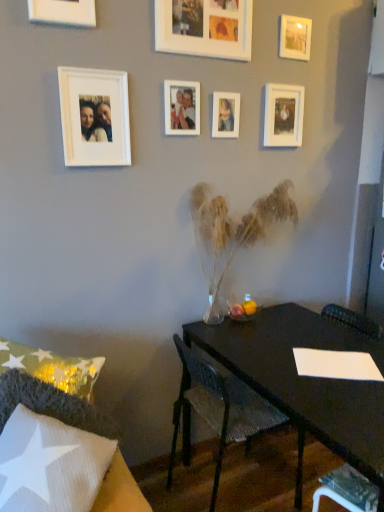
Where is `dark wood chair at lower center, which ranks as the 2th chair in left-to-right order`? The image size is (384, 512). dark wood chair at lower center, which ranks as the 2th chair in left-to-right order is located at coordinates (218, 406).

What is the approximate width of metallic silver swivel chair at lower right?

22.46 centimeters.

What do you see at coordinates (204, 28) in the screenshot?
I see `white matte picture frame at upper center, acting as the fourth picture frame starting from the right` at bounding box center [204, 28].

Image resolution: width=384 pixels, height=512 pixels. I want to click on white matte picture frame at upper left, the sixth picture frame from the right, so coord(94,117).

Where is `matte white photo frame at center, the 5th picture frame when ordered from left to right`? The height and width of the screenshot is (512, 384). matte white photo frame at center, the 5th picture frame when ordered from left to right is located at coordinates (226, 115).

Describe the element at coordinates (295, 37) in the screenshot. I see `matte white picture frame at upper right, which is counted as the first picture frame, starting from the right` at that location.

Locate an element on the screen. dark wood chair at lower center, which ranks as the 2th chair in left-to-right order is located at coordinates (218, 406).

Is white matte photo frame at center, the 3th picture frame when ordered from left to right, inside the boundaries of white matte picture frame at upper center, acting as the fourth picture frame starting from the right, or outside?

white matte photo frame at center, the 3th picture frame when ordered from left to right, is not enclosed by white matte picture frame at upper center, acting as the fourth picture frame starting from the right.

The width and height of the screenshot is (384, 512). I want to click on picture frame that is the 3rd object located above the white matte photo frame at center, the 3th picture frame when ordered from left to right (from the image's perspective), so click(204, 28).

Is white matte photo frame at center, acting as the fifth picture frame starting from the right, touching white matte picture frame at upper center, acting as the fourth picture frame starting from the right?

No, white matte photo frame at center, acting as the fifth picture frame starting from the right, is not beside white matte picture frame at upper center, acting as the fourth picture frame starting from the right.

From a real-world perspective, is white matte photo frame at center, the 3th picture frame when ordered from left to right, located beneath white matte picture frame at upper center, acting as the fourth picture frame starting from the right?

Indeed, from a real-world perspective, white matte photo frame at center, the 3th picture frame when ordered from left to right, is positioned beneath white matte picture frame at upper center, acting as the fourth picture frame starting from the right.

Choose the correct answer: Is white matte photo frame at center, acting as the fifth picture frame starting from the right, inside white matte picture frame at upper left, the 7th picture frame in the right-to-left sequence, or outside it?

white matte photo frame at center, acting as the fifth picture frame starting from the right, is outside white matte picture frame at upper left, the 7th picture frame in the right-to-left sequence.

From a real-world perspective, which object rests below the other?

white matte photo frame at center, the 3th picture frame when ordered from left to right.

Where is `the 2nd picture frame counting from the left side of the white matte photo frame at center, the 3th picture frame when ordered from left to right`? This screenshot has width=384, height=512. the 2nd picture frame counting from the left side of the white matte photo frame at center, the 3th picture frame when ordered from left to right is located at coordinates (63, 12).

What's the angular difference between white matte photo frame at center, the 3th picture frame when ordered from left to right, and white matte picture frame at upper left, the 1th picture frame viewed from the left,'s facing directions?

1.75 degrees separate the facing orientations of white matte photo frame at center, the 3th picture frame when ordered from left to right, and white matte picture frame at upper left, the 1th picture frame viewed from the left.

Could you measure the distance between white paper at lower right and dark wood chair at lower center, the 1th chair when ordered from back to front?

white paper at lower right and dark wood chair at lower center, the 1th chair when ordered from back to front, are 28.68 inches apart from each other.

Which of these two, white paper at lower right or dark wood chair at lower center, which ranks as the 2th chair in left-to-right order, is smaller?

white paper at lower right is smaller.

How many degrees apart are the facing directions of white paper at lower right and dark wood chair at lower center, placed as the 1th chair when sorted from right to left?

The angular difference between white paper at lower right and dark wood chair at lower center, placed as the 1th chair when sorted from right to left, is 106 degrees.

From the image's perspective, is white paper at lower right over dark wood chair at lower center, the 1th chair when ordered from back to front?

Incorrect, from the image's perspective, white paper at lower right is lower than dark wood chair at lower center, the 1th chair when ordered from back to front.

Considering the positions of objects dark wood chair at lower center, which ranks as the 2th chair in left-to-right order, and white fabric chair at lower left, the first chair when ordered from front to back, in the image provided, who is more to the right, dark wood chair at lower center, which ranks as the 2th chair in left-to-right order, or white fabric chair at lower left, the first chair when ordered from front to back,?

From the viewer's perspective, dark wood chair at lower center, which ranks as the 2th chair in left-to-right order, appears more on the right side.

From a real-world perspective, is dark wood chair at lower center, placed as the 1th chair when sorted from right to left, on top of white fabric chair at lower left, which appears as the first chair when viewed from the left?

No, from a real-world perspective, dark wood chair at lower center, placed as the 1th chair when sorted from right to left, is not over white fabric chair at lower left, which appears as the first chair when viewed from the left

Between dark wood chair at lower center, the 1th chair when ordered from back to front, and white fabric chair at lower left, marked as the 2th chair in a back-to-front arrangement, which one is positioned behind?

Positioned behind is dark wood chair at lower center, the 1th chair when ordered from back to front.

Is dark wood chair at lower center, which is counted as the second chair, starting from the front, directly adjacent to white fabric chair at lower left, the first chair when ordered from front to back?

No, dark wood chair at lower center, which is counted as the second chair, starting from the front, is not beside white fabric chair at lower left, the first chair when ordered from front to back.

Is white matte picture frame at upper left, the 1th picture frame viewed from the left, smaller than white matte picture frame at upper center, placed as the 4th picture frame when sorted from left to right?

Yes.

You are a GUI agent. You are given a task and a screenshot of the screen. Output one action in this format:
    pyautogui.click(x=<x>, y=<y>)
    Task: Click on the 3rd picture frame to the right when counting from the white matte picture frame at upper left, the 1th picture frame viewed from the left
    
    Given the screenshot: What is the action you would take?
    pyautogui.click(x=204, y=28)

From a real-world perspective, is white matte picture frame at upper left, the 7th picture frame in the right-to-left sequence, over white matte picture frame at upper center, acting as the fourth picture frame starting from the right?

Yes.

Is white matte picture frame at upper left, the 7th picture frame in the right-to-left sequence, next to white matte picture frame at upper center, acting as the fourth picture frame starting from the right, and touching it?

white matte picture frame at upper left, the 7th picture frame in the right-to-left sequence, is not next to white matte picture frame at upper center, acting as the fourth picture frame starting from the right, and they're not touching.

Locate an element on the screen. the 1st picture frame below when counting from the matte white photo frame at center, the 5th picture frame when ordered from left to right (from the image's perspective) is located at coordinates (182, 108).

Which is in front, point (217, 137) or point (178, 85)?

Point (178, 85)

Consider the image. Is matte white photo frame at center, the third picture frame positioned from the right, not near white matte photo frame at center, acting as the fifth picture frame starting from the right?

No, matte white photo frame at center, the third picture frame positioned from the right, is not far from white matte photo frame at center, acting as the fifth picture frame starting from the right.

Considering the sizes of matte white photo frame at center, the 5th picture frame when ordered from left to right, and white matte photo frame at center, acting as the fifth picture frame starting from the right, in the image, is matte white photo frame at center, the 5th picture frame when ordered from left to right, taller or shorter than white matte photo frame at center, acting as the fifth picture frame starting from the right,?

Clearly, matte white photo frame at center, the 5th picture frame when ordered from left to right, is shorter compared to white matte photo frame at center, acting as the fifth picture frame starting from the right.

Who is smaller, white matte photo frame at center, acting as the fifth picture frame starting from the right, or metallic silver swivel chair at lower right?

white matte photo frame at center, acting as the fifth picture frame starting from the right, is smaller.

Does white matte photo frame at center, acting as the fifth picture frame starting from the right, appear on the left side of metallic silver swivel chair at lower right?

Yes.

Find the location of a particular element. swivel chair located on the right of white matte photo frame at center, the 3th picture frame when ordered from left to right is located at coordinates (347, 490).

Considering the relative sizes of white matte photo frame at center, the 3th picture frame when ordered from left to right, and metallic silver swivel chair at lower right in the image provided, is white matte photo frame at center, the 3th picture frame when ordered from left to right, taller than metallic silver swivel chair at lower right?

Yes, white matte photo frame at center, the 3th picture frame when ordered from left to right, is taller than metallic silver swivel chair at lower right.

This screenshot has height=512, width=384. Identify the location of the 3rd picture frame below the white matte picture frame at upper center, acting as the fourth picture frame starting from the right (from the image's perspective). (182, 108).

You are a GUI agent. You are given a task and a screenshot of the screen. Output one action in this format:
    pyautogui.click(x=<x>, y=<y>)
    Task: Click on the 3rd picture frame directly above the white matte photo frame at center, acting as the fifth picture frame starting from the right (from a real-world perspective)
    The width and height of the screenshot is (384, 512).
    Given the screenshot: What is the action you would take?
    pyautogui.click(x=63, y=12)

Estimate the real-world distances between objects in this image. Which object is further from metallic silver swivel chair at lower right, dark wood chair at lower center, the 1th chair when ordered from back to front, or white matte picture frame at upper right, arranged as the second picture frame when viewed from the right?

white matte picture frame at upper right, arranged as the second picture frame when viewed from the right.

When comparing their distances from dark wood chair at lower center, placed as the 1th chair when sorted from right to left, does white matte photo frame at center, acting as the fifth picture frame starting from the right, or white fabric chair at lower left, which appears as the first chair when viewed from the left, seem closer?

white fabric chair at lower left, which appears as the first chair when viewed from the left, is closer to dark wood chair at lower center, placed as the 1th chair when sorted from right to left.

When comparing their distances from metallic silver swivel chair at lower right, does dark wood chair at lower center, placed as the 1th chair when sorted from right to left, or white paper at lower right seem further?

white paper at lower right.

Estimate the real-world distances between objects in this image. Which object is further from matte white picture frame at upper right, which is counted as the first picture frame, starting from the right, matte white photo frame at center, the 5th picture frame when ordered from left to right, or white matte picture frame at upper left, the 2th picture frame from the left?

white matte picture frame at upper left, the 2th picture frame from the left, lies further to matte white picture frame at upper right, which is counted as the first picture frame, starting from the right, than the other object.

In the scene shown: Looking at the image, which one is located further to matte white photo frame at center, the third picture frame positioned from the right, matte white picture frame at upper right, the seventh picture frame in the left-to-right sequence, or white matte picture frame at upper left, the 2th picture frame from the left?

white matte picture frame at upper left, the 2th picture frame from the left, is positioned further to the anchor matte white photo frame at center, the third picture frame positioned from the right.

Considering their positions, is dark wood chair at lower center, which ranks as the 2th chair in left-to-right order, positioned further to white matte photo frame at center, the 3th picture frame when ordered from left to right, than white matte picture frame at upper right, arranged as the second picture frame when viewed from the right?

dark wood chair at lower center, which ranks as the 2th chair in left-to-right order.

Considering their positions, is white matte photo frame at center, the 3th picture frame when ordered from left to right, positioned further to dark wood chair at lower center, placed as the 1th chair when sorted from right to left, than white paper at lower right?

white matte photo frame at center, the 3th picture frame when ordered from left to right, lies further to dark wood chair at lower center, placed as the 1th chair when sorted from right to left, than the other object.

Looking at the image, which one is located further to metallic silver swivel chair at lower right, dark wood chair at lower center, which is counted as the second chair, starting from the front, or white matte photo frame at center, the 3th picture frame when ordered from left to right?

white matte photo frame at center, the 3th picture frame when ordered from left to right, is positioned further to the anchor metallic silver swivel chair at lower right.

Where is `chair between white matte picture frame at upper center, acting as the fourth picture frame starting from the right, and dark wood chair at lower center, the 1th chair when ordered from back to front, in the vertical direction`? The width and height of the screenshot is (384, 512). chair between white matte picture frame at upper center, acting as the fourth picture frame starting from the right, and dark wood chair at lower center, the 1th chair when ordered from back to front, in the vertical direction is located at coordinates (51, 404).

Locate an element on the screen. The height and width of the screenshot is (512, 384). chair between matte white photo frame at center, the 5th picture frame when ordered from left to right, and dark wood chair at lower center, which is counted as the second chair, starting from the front, vertically is located at coordinates (51, 404).

The height and width of the screenshot is (512, 384). What are the coordinates of `armchair between white matte picture frame at upper left, the 2th picture frame from the left, and metallic silver swivel chair at lower right from top to bottom` in the screenshot? It's located at (353, 321).

Identify the location of picture frame that lies between white matte photo frame at center, the 3th picture frame when ordered from left to right, and white paper at lower right from top to bottom. This screenshot has width=384, height=512. (94, 117).